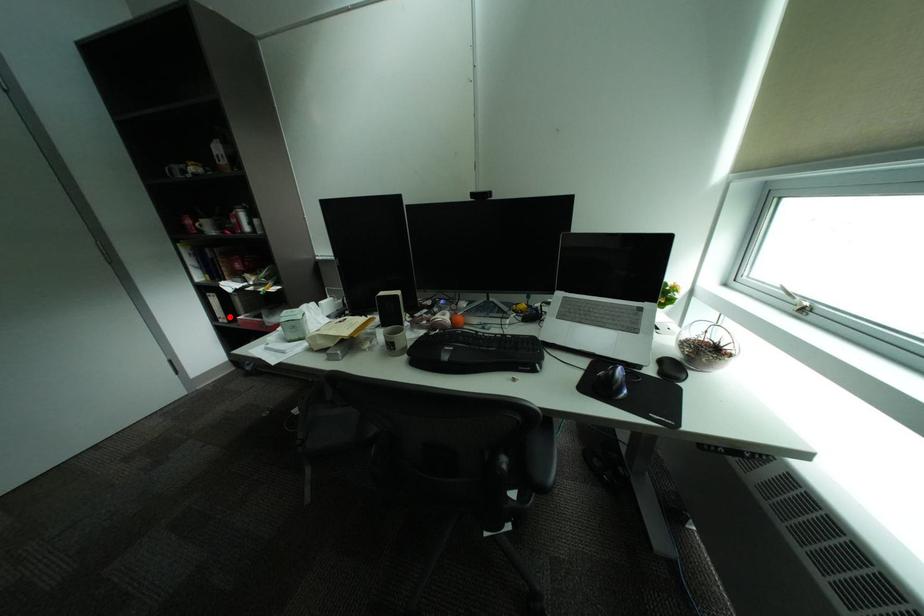
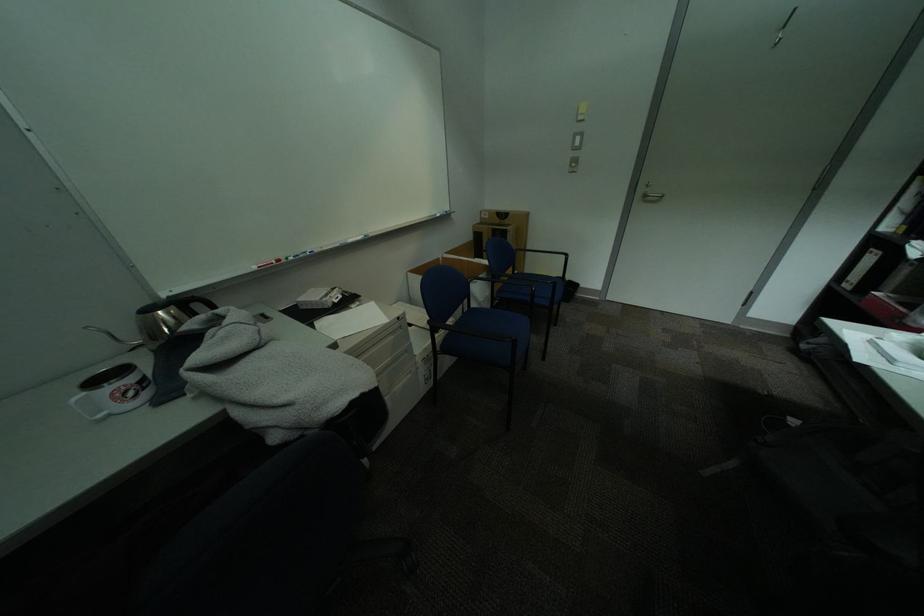
Question: I am providing you with two images of the same scene from different viewpoints. A red point is marked on the first image. Can you still see the location of the red point in image 2?

Choices:
 (A) Yes
 (B) No

Answer: (A)